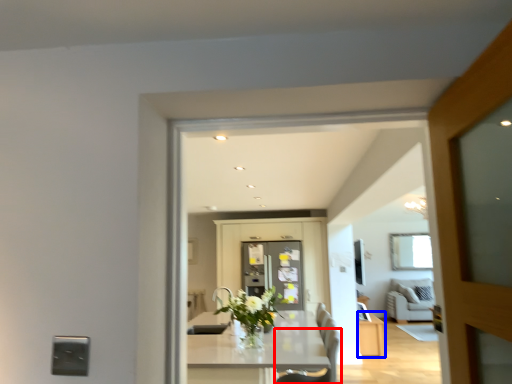
Question: Which object appears farthest to the camera in this image, chair (highlighted by a red box) or cabinetry (highlighted by a blue box)?

Choices:
 (A) chair
 (B) cabinetry

Answer: (B)